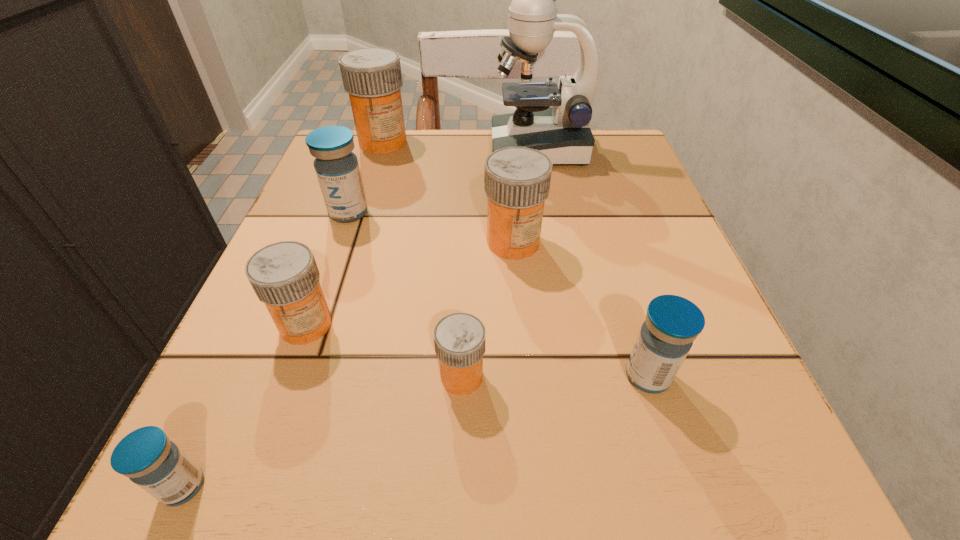
Identify the location of the rightmost blue medicine. The height and width of the screenshot is (540, 960). (672, 323).

Where is `the smallest orange medicine`? the smallest orange medicine is located at coordinates (459, 338).

At what (x,y) coordinates should I click in order to perform the action: click on the fourth object from right to left. Please return your answer as a coordinate pair (x, y). Looking at the image, I should click on (459, 338).

Find the location of a particular element. The height and width of the screenshot is (540, 960). the nearest blue medicine is located at coordinates (157, 465).

You are a GUI agent. You are given a task and a screenshot of the screen. Output one action in this format:
    pyautogui.click(x=<x>, y=<y>)
    Task: Click on the smallest blue medicine
    This screenshot has width=960, height=540.
    Given the screenshot: What is the action you would take?
    pyautogui.click(x=157, y=465)

The height and width of the screenshot is (540, 960). Identify the location of free space located at the eyepiece of the tallest object. (423, 148).

You are a GUI agent. You are given a task and a screenshot of the screen. Output one action in this format:
    pyautogui.click(x=<x>, y=<y>)
    Task: Click on the blank area located 0.320m at the eyepiece of the tallest object
    This screenshot has width=960, height=540.
    Given the screenshot: What is the action you would take?
    pyautogui.click(x=346, y=148)

Locate an element on the screen. blank space located 0.240m at the eyepiece of the tallest object is located at coordinates (382, 148).

At what (x,y) coordinates should I click in order to perform the action: click on free space located on the label side of the farthest medicine. Please return your answer as a coordinate pair (x, y). The width and height of the screenshot is (960, 540). Looking at the image, I should click on (371, 181).

Identify the location of vacant region located on the front of the biggest blue medicine. The width and height of the screenshot is (960, 540). (330, 265).